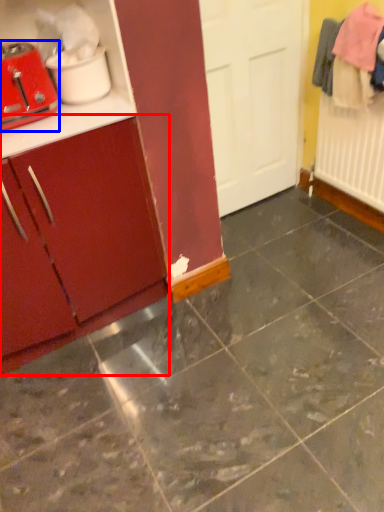
Question: Which object is further to the camera taking this photo, cabinetry (highlighted by a red box) or toaster (highlighted by a blue box)?

Choices:
 (A) cabinetry
 (B) toaster

Answer: (B)